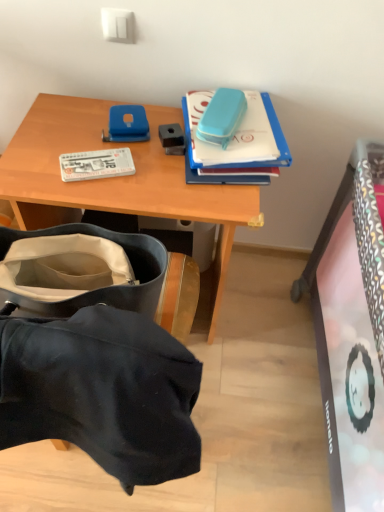
Identify the location of free spot behind white matte book at left, the 1th book when ordered from left to right. (102, 125).